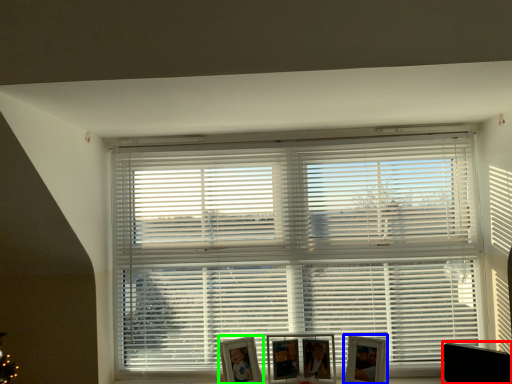
Question: Which object is the closest to the swivel chair (highlighted by a red box)? Choose among these: picture frame (highlighted by a blue box) or picture frame (highlighted by a green box).

Choices:
 (A) picture frame
 (B) picture frame

Answer: (A)